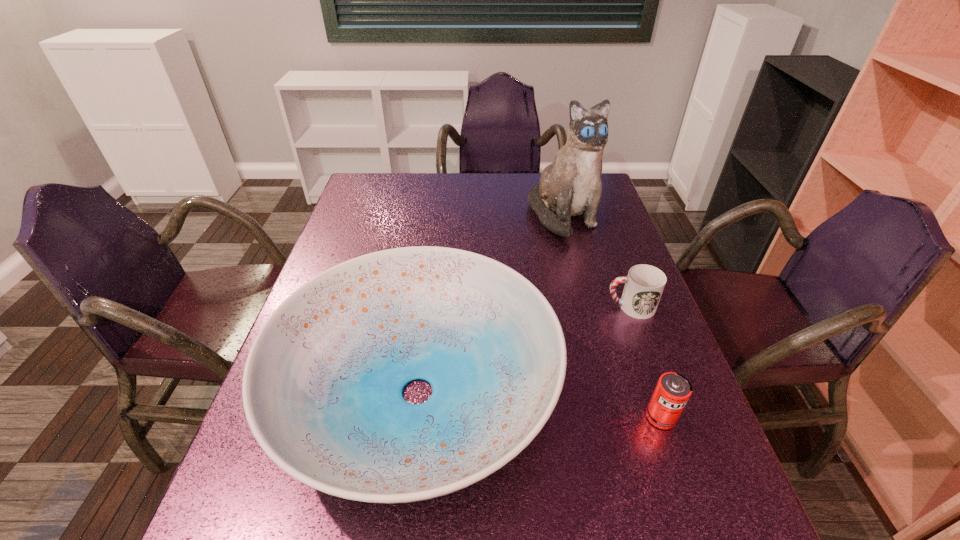
Find the location of a particular element. This screenshot has height=540, width=960. cat positioned at the right edge is located at coordinates (570, 186).

Find the location of `can that is positioned at the right edge`. can that is positioned at the right edge is located at coordinates (672, 392).

I want to click on cup at the right edge, so click(x=644, y=285).

Locate an element on the screen. object at the far right corner is located at coordinates (570, 186).

Where is `free space at the far edge of the desktop`? Image resolution: width=960 pixels, height=540 pixels. free space at the far edge of the desktop is located at coordinates (503, 173).

I want to click on vacant space at the left edge of the desktop, so click(351, 252).

In the image, there is a desktop. Where is `vacant space at the right edge`? This screenshot has height=540, width=960. vacant space at the right edge is located at coordinates (598, 241).

In the image, there is a desktop. Where is `free space at the far left corner`? free space at the far left corner is located at coordinates 372,182.

You are a GUI agent. You are given a task and a screenshot of the screen. Output one action in this format:
    pyautogui.click(x=<x>, y=<y>)
    Task: Click on the free space between the can and the farthest object
    The image size is (960, 540).
    Given the screenshot: What is the action you would take?
    pyautogui.click(x=612, y=316)

Identify the location of unoccupied area between the can and the cat. (612, 316).